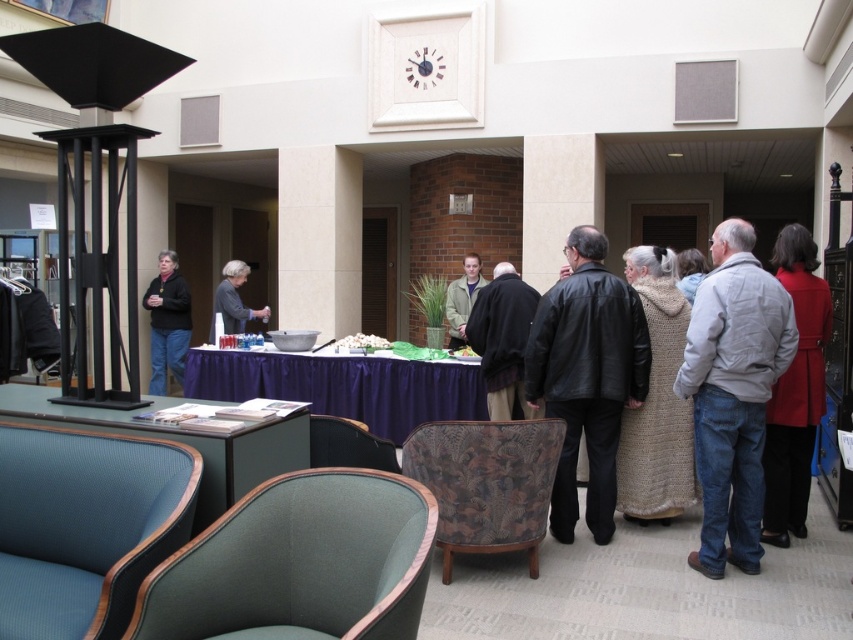
Question: Can you confirm if purple fabric table at center is wider than gray wool sweater at center?

Choices:
 (A) no
 (B) yes

Answer: (B)

Question: Which of the following is the closest to the observer?

Choices:
 (A) (492, 484)
 (B) (212, 493)
 (C) (264, 372)
 (D) (517, 403)

Answer: (B)

Question: Is red wool coat at right to the right of teal fabric table at lower left from the viewer's perspective?

Choices:
 (A) no
 (B) yes

Answer: (B)

Question: Which of the following is the farthest from the observer?

Choices:
 (A) (482, 534)
 (B) (630, 392)
 (C) (38, 595)

Answer: (B)

Question: Is red wool coat at right below black matte jacket at left?

Choices:
 (A) yes
 (B) no

Answer: (A)

Question: Which point is farther to the camera?

Choices:
 (A) (740, 228)
 (B) (367, 454)
 (C) (341, 378)
 (D) (148, 285)

Answer: (D)